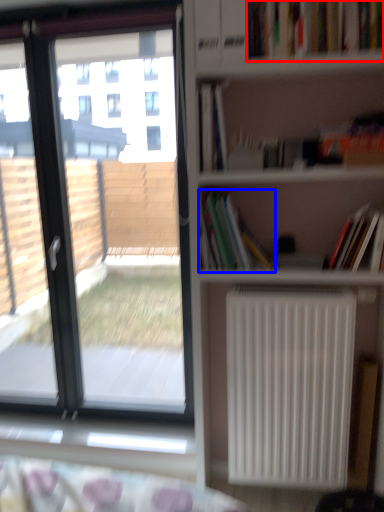
Question: Among these objects, which one is nearest to the camera, book (highlighted by a red box) or book (highlighted by a blue box)?

Choices:
 (A) book
 (B) book

Answer: (A)